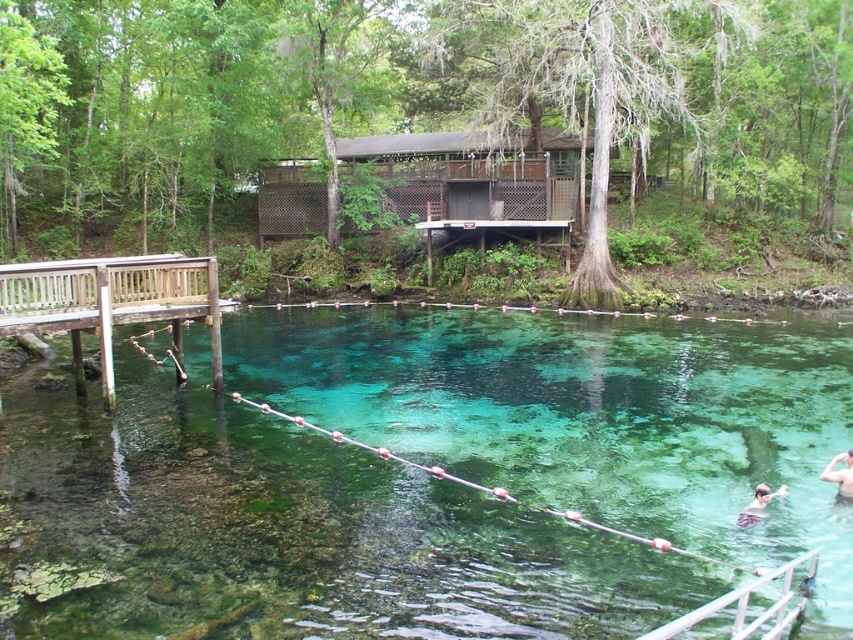
Question: Is clear glass water at center smaller than smooth skin person at lower right?

Choices:
 (A) yes
 (B) no

Answer: (B)

Question: Is wooden dock at left behind smooth skin person at lower right?

Choices:
 (A) yes
 (B) no

Answer: (A)

Question: Based on their relative distances, which object is nearer to the skinny man at lower right?

Choices:
 (A) wooden dock at left
 (B) smooth skin person at lower right
 (C) clear glass water at center

Answer: (B)

Question: Which point is closer to the camera?

Choices:
 (A) (788, 404)
 (B) (759, 493)
 (C) (171, 292)

Answer: (B)

Question: Which of the following is the closest to the observer?

Choices:
 (A) (752, 508)
 (B) (15, 317)
 (C) (848, 472)
 (D) (51, 499)

Answer: (A)

Question: Is the position of clear glass water at center less distant than that of smooth skin person at lower right?

Choices:
 (A) no
 (B) yes

Answer: (B)